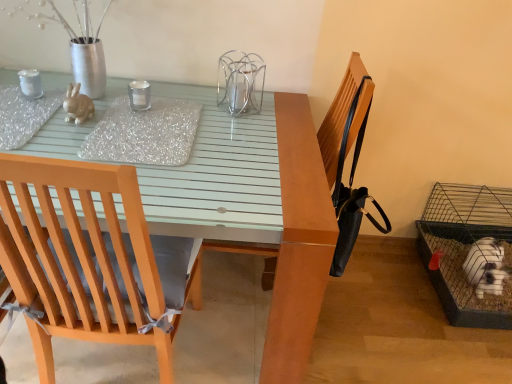
Locate an element on the screen. The width and height of the screenshot is (512, 384). free space to the back side of clear glass candle at center is located at coordinates tap(166, 93).